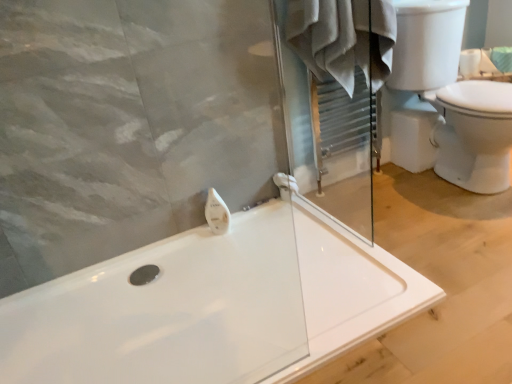
The height and width of the screenshot is (384, 512). I want to click on empty space that is in between white glossy soap dispenser at upper center and white plastic towel bar at center, so click(259, 214).